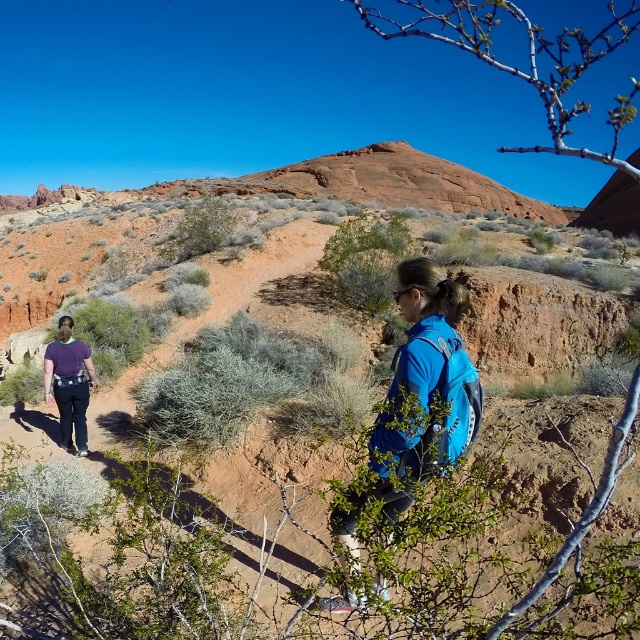
Question: Can you confirm if blue fabric backpack at center is positioned to the right of purple fabric backpack at lower left?

Choices:
 (A) yes
 (B) no

Answer: (A)

Question: Which object appears closest to the camera in this image?

Choices:
 (A) blue fabric backpack at center
 (B) purple fabric backpack at lower left

Answer: (A)

Question: Which point is farther to the camera?

Choices:
 (A) purple fabric backpack at lower left
 (B) blue fabric backpack at center

Answer: (A)

Question: Is blue fabric backpack at center thinner than purple fabric backpack at lower left?

Choices:
 (A) no
 (B) yes

Answer: (A)

Question: Does blue fabric backpack at center appear on the left side of purple fabric backpack at lower left?

Choices:
 (A) no
 (B) yes

Answer: (A)